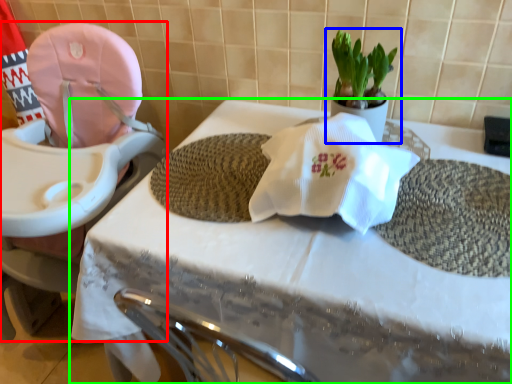
Question: Considering the real-world distances, which object is closest to baby carriage (highlighted by a red box)? houseplant (highlighted by a blue box) or table (highlighted by a green box).

Choices:
 (A) houseplant
 (B) table

Answer: (B)